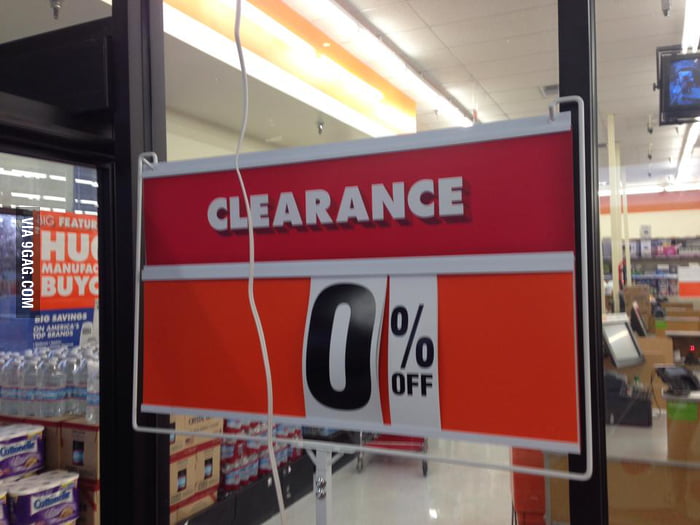
Identify the location of monitor. (682, 89).